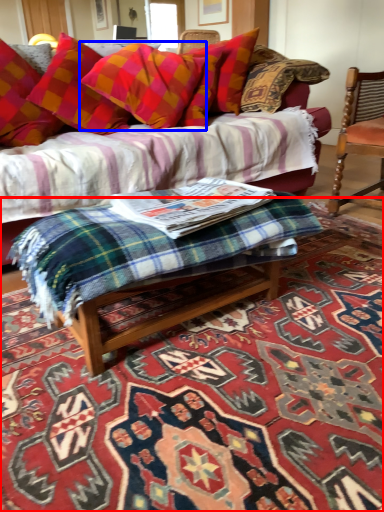
Question: Among these objects, which one is farthest to the camera, mat (highlighted by a red box) or pillow (highlighted by a blue box)?

Choices:
 (A) mat
 (B) pillow

Answer: (B)